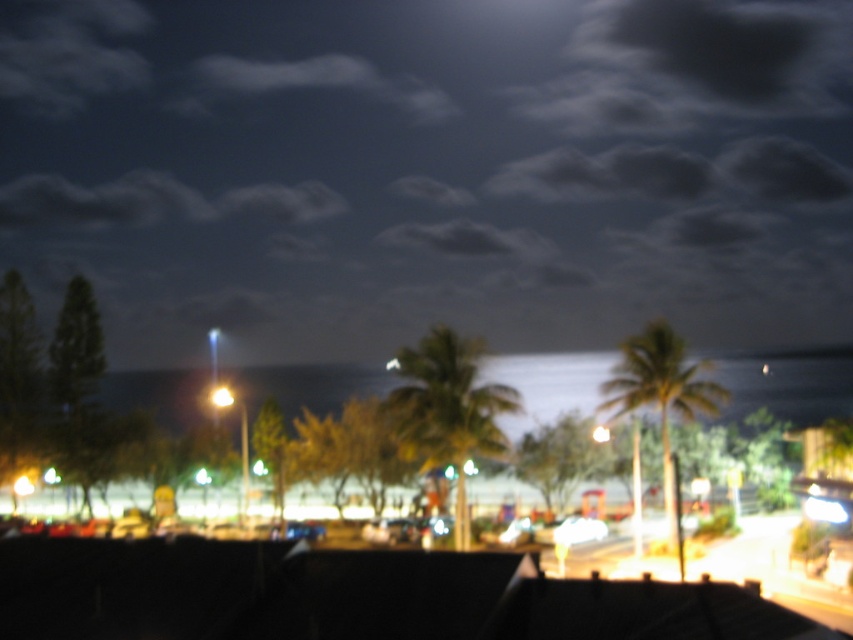
Question: Which is farther from the green leafy palm tree at center?

Choices:
 (A) yellow matte light at center
 (B) green leafy palm tree at right
 (C) black matte roof at lower center

Answer: (A)

Question: Does green leafy palm tree at right have a greater width compared to yellow matte light at center?

Choices:
 (A) no
 (B) yes

Answer: (A)

Question: Among these points, which one is farthest from the camera?

Choices:
 (A) (492, 426)
 (B) (152, 552)

Answer: (A)

Question: From the image, what is the correct spatial relationship of green leafy palm tree at center in relation to green leafy palm tree at right?

Choices:
 (A) above
 (B) below

Answer: (A)

Question: Which of these objects is positioned farthest from the green leafy palm tree at center?

Choices:
 (A) green leafy palm tree at right
 (B) black matte roof at lower center

Answer: (B)

Question: Does green leafy palm tree at right have a greater width compared to yellow matte light at center?

Choices:
 (A) yes
 (B) no

Answer: (B)